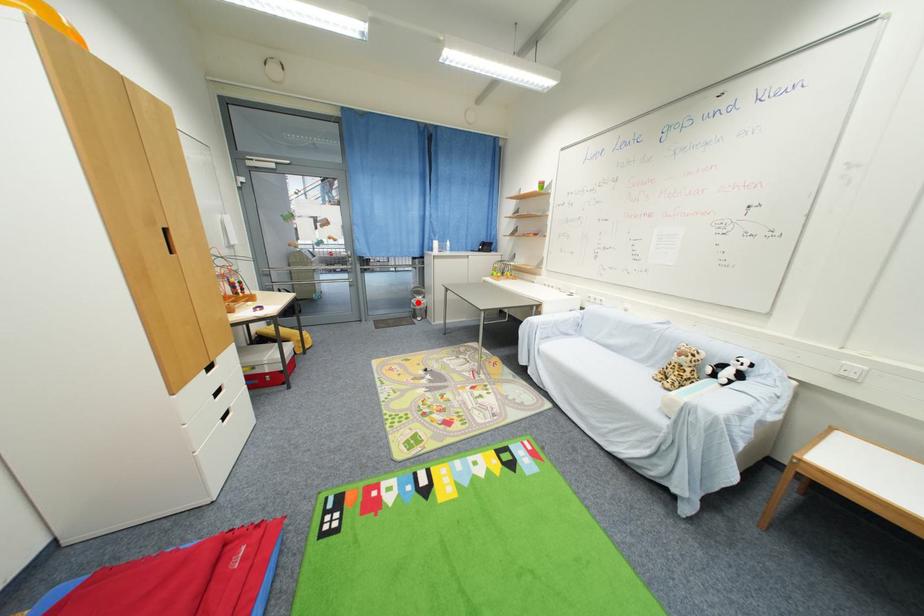
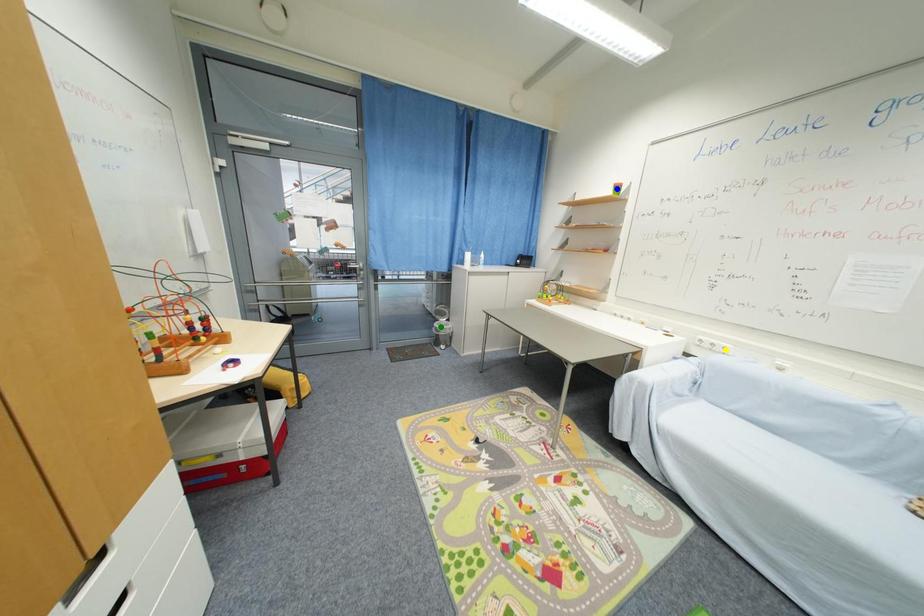
Question: I am providing you with two images of the same scene from different viewpoints. A red point is marked on the first image. You are given multiple points on the second image. Which spot in image 2 lines up with the point in image 1?

Choices:
 (A) green point
 (B) blue point
 (C) yellow point

Answer: (A)